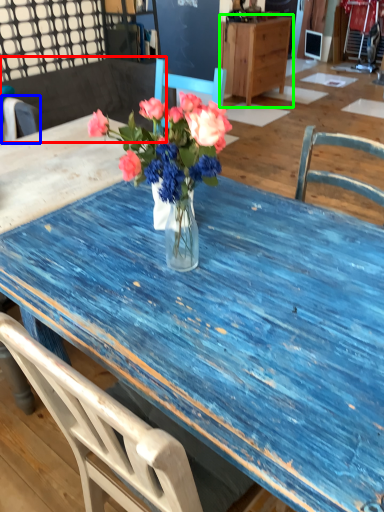
Question: Which object is the farthest from chair (highlighted by a red box)? Choose among these: chair (highlighted by a blue box) or cabinetry (highlighted by a green box).

Choices:
 (A) chair
 (B) cabinetry

Answer: (B)